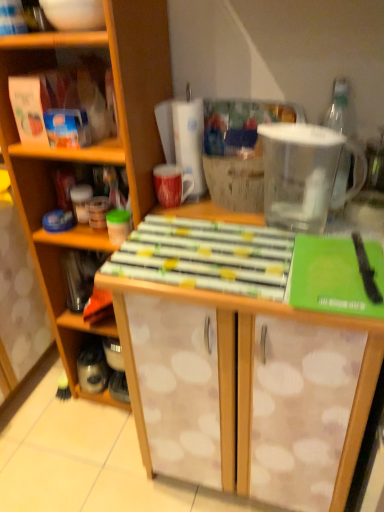
At what (x,y) coordinates should I click in order to perform the action: click on vacant space situated above wooden table at center (from a real-world perspective). Please return your answer as a coordinate pair (x, y). This screenshot has height=512, width=384. Looking at the image, I should click on (262, 241).